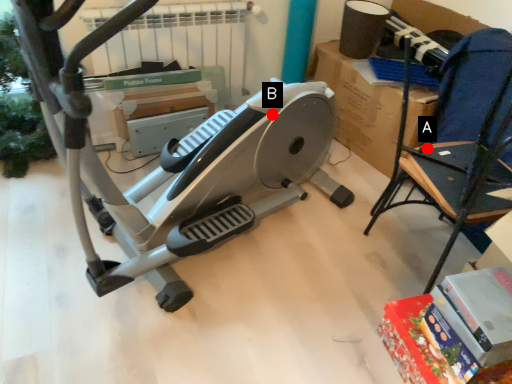
Question: Two points are circled on the image, labeled by A and B beside each circle. Which point is farther from the camera taking this photo?

Choices:
 (A) A is further
 (B) B is further

Answer: (A)